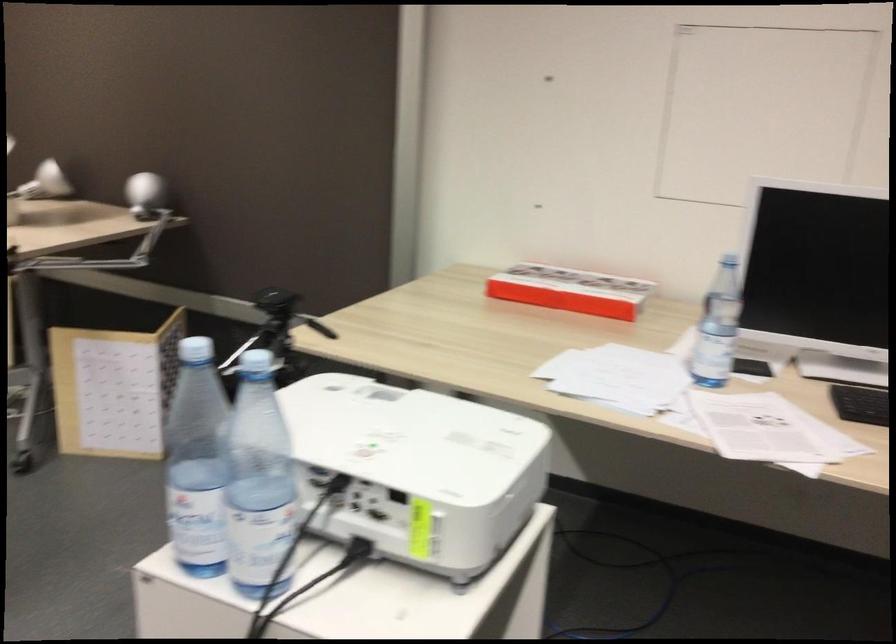
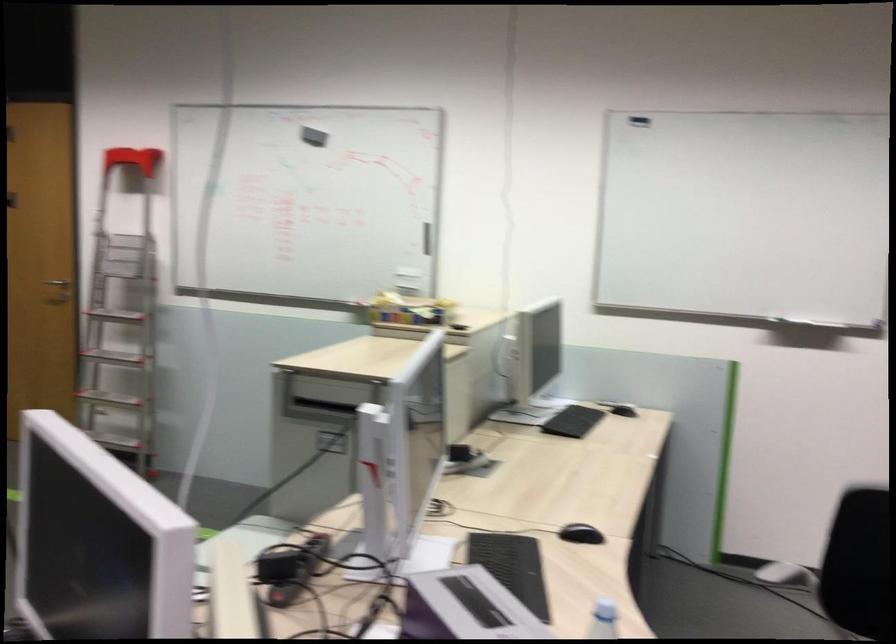
Question: The camera is either moving clockwise (left) or counter-clockwise (right) around the object. The first image is from the beginning of the video and the second image is from the end. Is the camera moving left or right when shooting the video?

Choices:
 (A) Left
 (B) Right

Answer: (B)